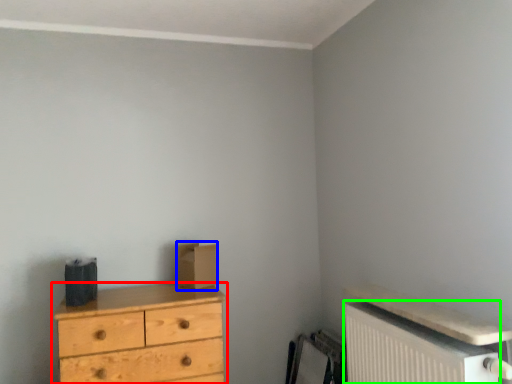
Question: Estimate the real-world distances between objects in this image. Which object is farther from chest of drawers (highlighted by a red box), cardboard box (highlighted by a blue box) or radiator (highlighted by a green box)?

Choices:
 (A) cardboard box
 (B) radiator

Answer: (B)